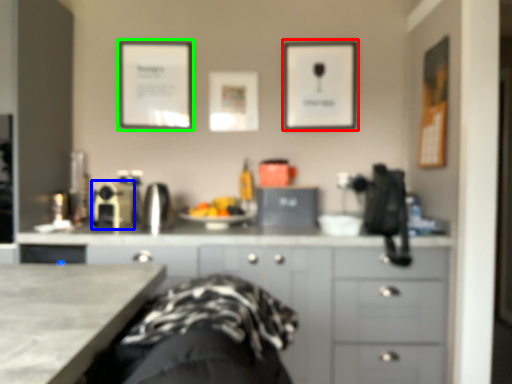
Question: Which object is the closest to the picture frame (highlighted by a red box)? Choose among these: appliance (highlighted by a blue box) or picture frame (highlighted by a green box).

Choices:
 (A) appliance
 (B) picture frame

Answer: (B)